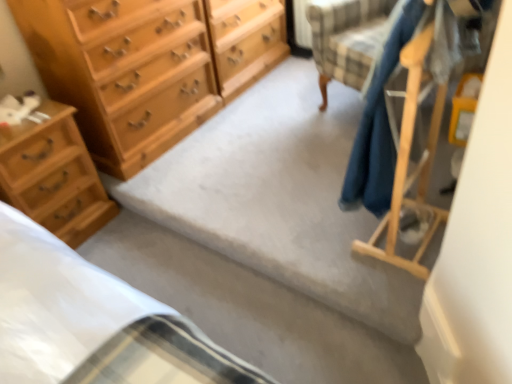
Where is `empty space that is ontop of carpet at center (from a real-world perspective)`? empty space that is ontop of carpet at center (from a real-world perspective) is located at coordinates (273, 140).